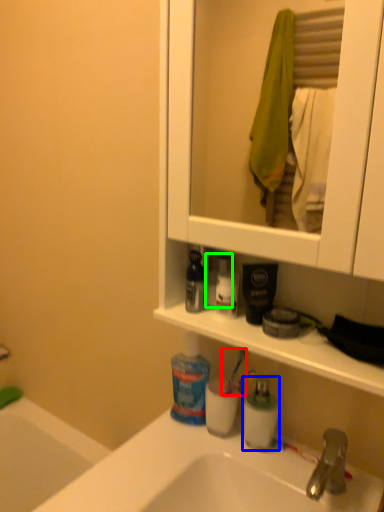
Question: Which object is positioned farthest from toothbrush (highlighted by a red box)? Select from toiletry (highlighted by a blue box) and toiletry (highlighted by a green box).

Choices:
 (A) toiletry
 (B) toiletry

Answer: (B)